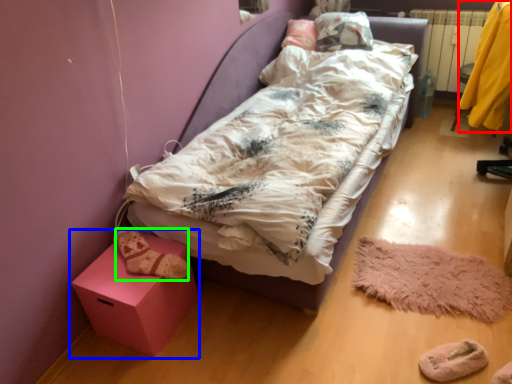
Question: Which object is the closest to the clothing (highlighted by a red box)? Choose among these: furniture (highlighted by a blue box) or shoe (highlighted by a green box).

Choices:
 (A) furniture
 (B) shoe

Answer: (B)